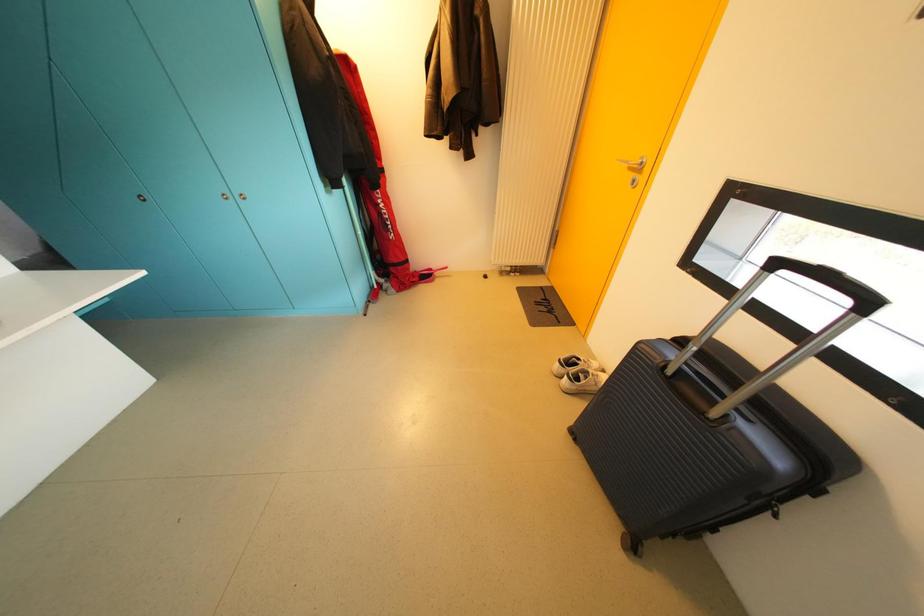
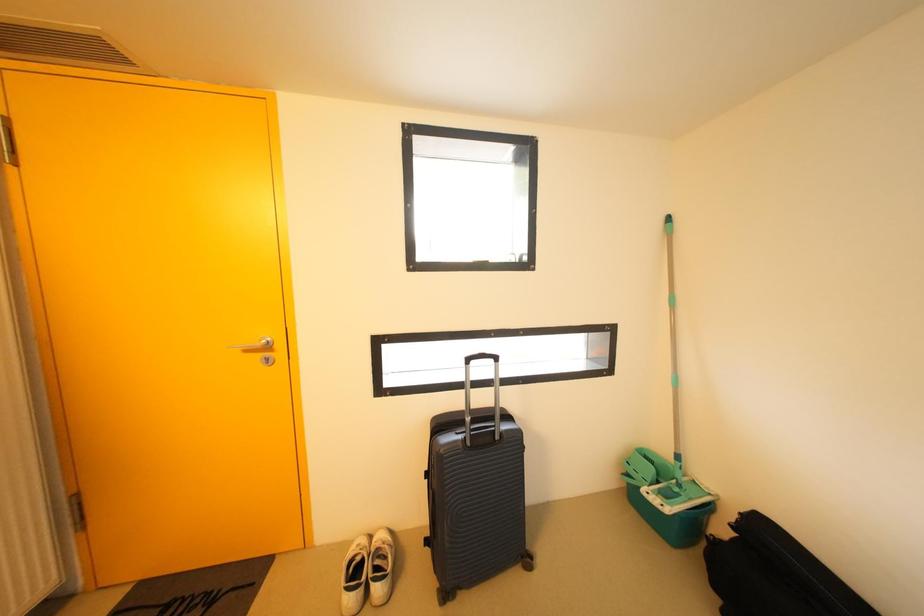
Question: The first image is from the beginning of the video and the second image is from the end. How did the camera likely rotate when shooting the video?

Choices:
 (A) Left
 (B) Right
 (C) Up
 (D) Down

Answer: (B)